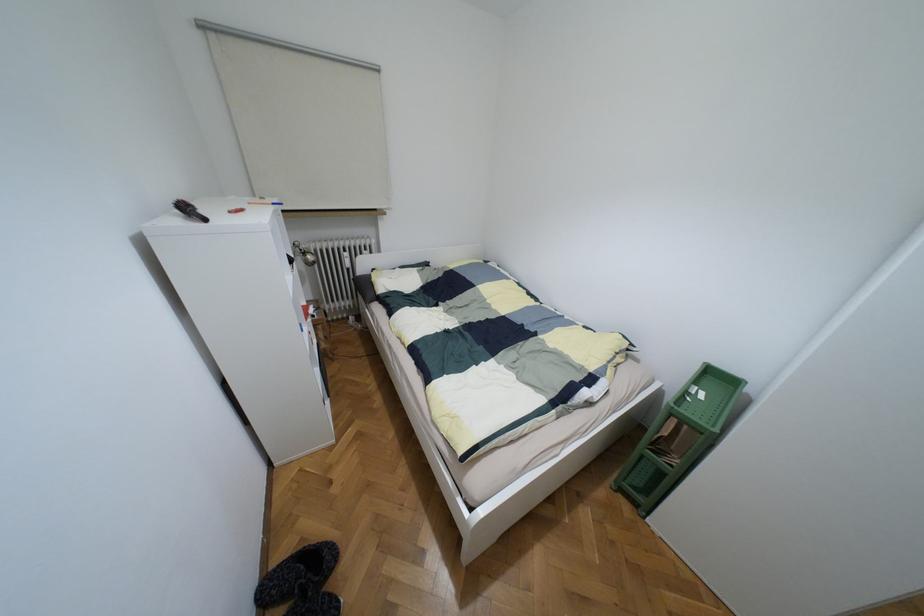
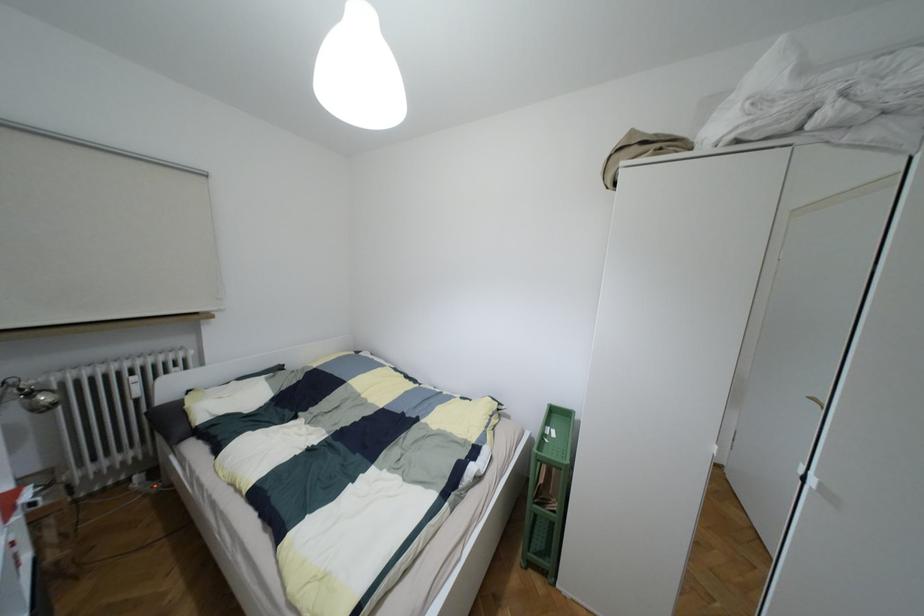
The point at [700,395] is marked in the first image. Where is the corresponding point in the second image?

(553, 434)